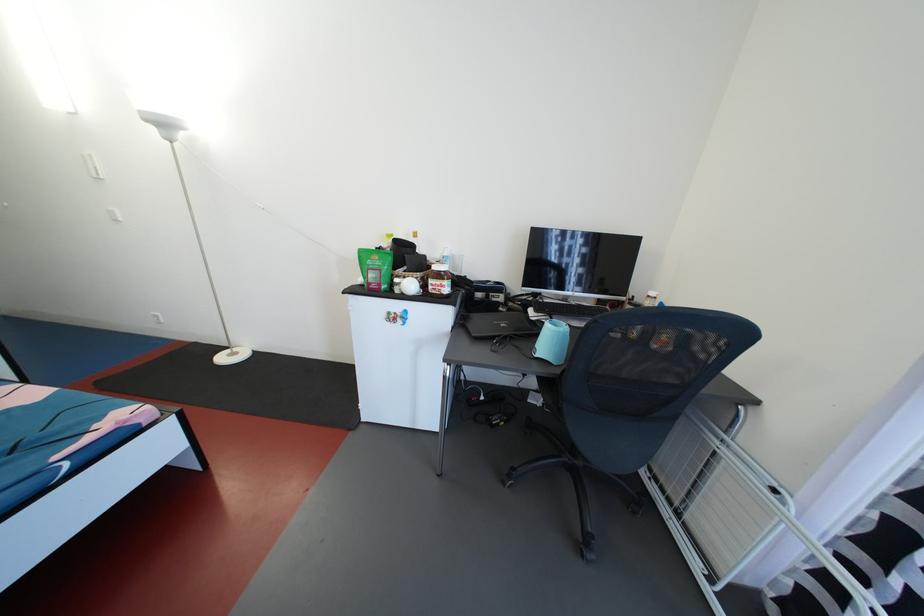
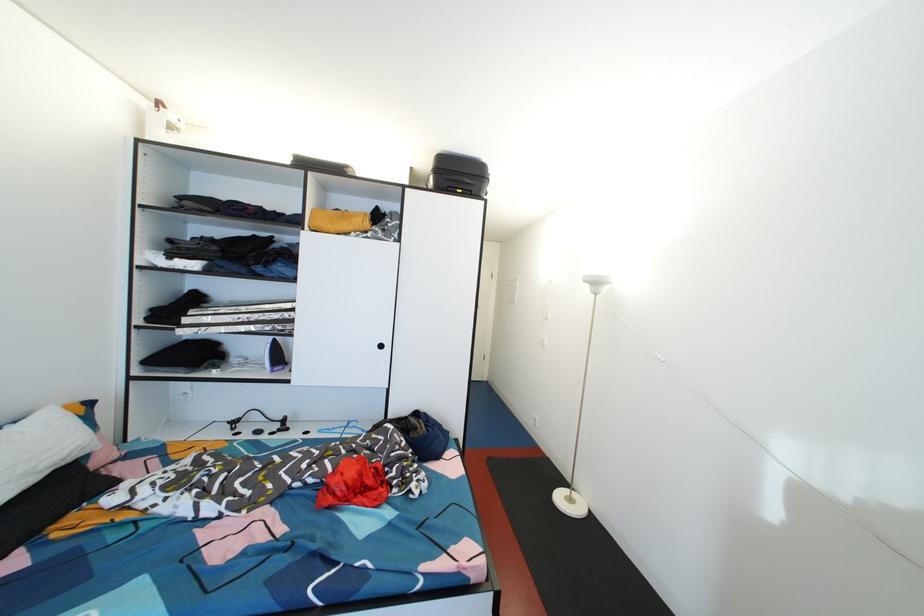
Question: The images are taken continuously from a first-person perspective. In which direction is your viewpoint rotating?

Choices:
 (A) Left
 (B) Right
 (C) Up
 (D) Down

Answer: (A)